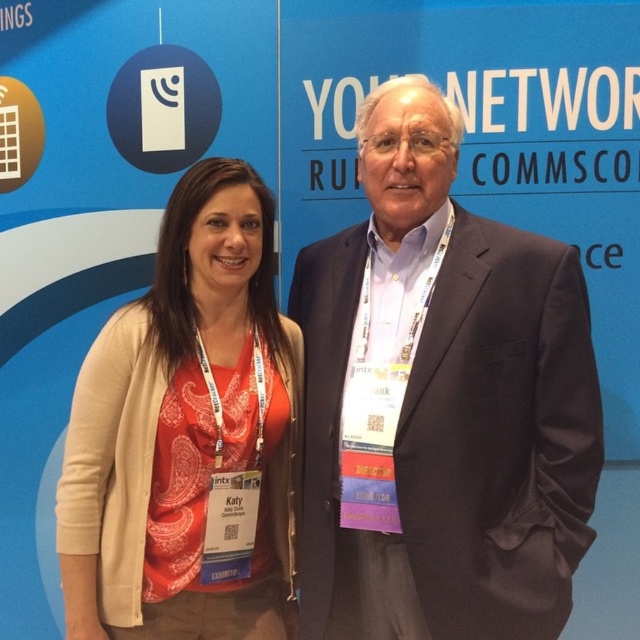
Which is below, satin black suit at center or matte orange shirt at center?

Positioned lower is matte orange shirt at center.

Does satin black suit at center have a greater width compared to matte orange shirt at center?

Yes.

The image size is (640, 640). In order to click on satin black suit at center in this screenshot , I will do `click(440, 403)`.